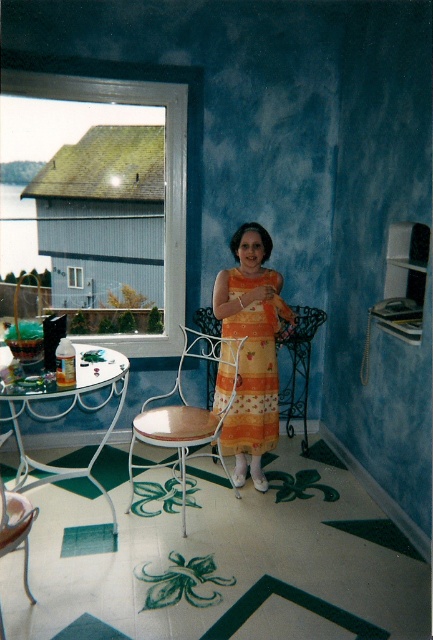
Is orange printed fabric dress at center wider than wooden seat at center?

No.

Between orange printed fabric dress at center and wooden seat at center, which one appears on the right side from the viewer's perspective?

orange printed fabric dress at center is more to the right.

Does point (271, 333) come closer to viewer compared to point (219, 456)?

Yes, it is.

In order to click on orange printed fabric dress at center in this screenshot , I will do `click(248, 381)`.